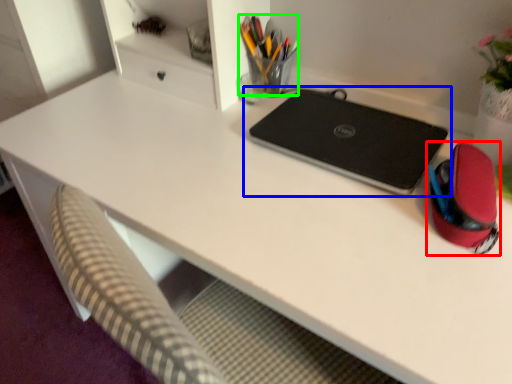
Question: Based on their relative distances, which object is farther from stationery (highlighted by a red box)? Choose from laptop (highlighted by a blue box) and stationery (highlighted by a green box).

Choices:
 (A) laptop
 (B) stationery

Answer: (B)